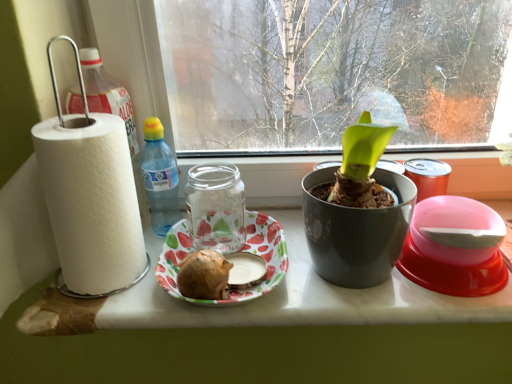
Where is `vacant area situated to the left side of brown matte potato at center`? vacant area situated to the left side of brown matte potato at center is located at coordinates (123, 301).